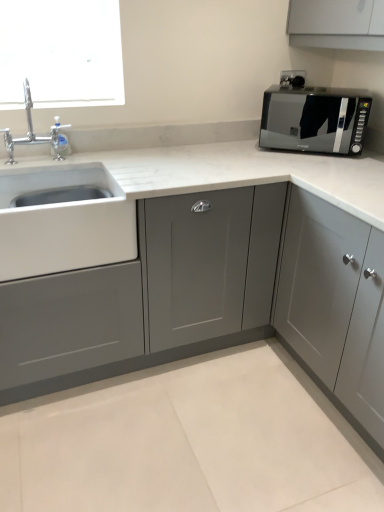
What is the approximate height of matte gray cabinet at upper right, arranged as the second cabinetry when viewed from the left?

39.06 inches.

Describe the element at coordinates (321, 293) in the screenshot. This screenshot has height=512, width=384. I see `matte gray cabinet at upper right, which is the first cabinetry in right-to-left order` at that location.

The width and height of the screenshot is (384, 512). What are the coordinates of `black glossy microwave at upper right` in the screenshot? It's located at (314, 119).

In order to face black glossy microwave at upper right, should I rotate leftwards or rightwards?

Turn right by 16.096 degrees to look at black glossy microwave at upper right.

Describe the element at coordinates (149, 295) in the screenshot. I see `matte gray cabinet at center, acting as the second cabinetry starting from the right` at that location.

Find the location of `white matte sink at left`. white matte sink at left is located at coordinates (63, 222).

In the scene shown: Measure the distance from matte gray cabinet at upper right, which is the first cabinetry in right-to-left order, to white matte sink at left.

The distance of matte gray cabinet at upper right, which is the first cabinetry in right-to-left order, from white matte sink at left is 32.58 inches.

Which of these two, matte gray cabinet at upper right, which is the first cabinetry in right-to-left order, or white matte sink at left, is bigger?

matte gray cabinet at upper right, which is the first cabinetry in right-to-left order, is bigger.

Which object is closer to the camera taking this photo, matte gray cabinet at upper right, arranged as the second cabinetry when viewed from the left, or white matte sink at left?

matte gray cabinet at upper right, arranged as the second cabinetry when viewed from the left, is in front.

In terms of height, does matte gray cabinet at upper right, arranged as the second cabinetry when viewed from the left, look taller or shorter compared to white matte sink at left?

Clearly, matte gray cabinet at upper right, arranged as the second cabinetry when viewed from the left, is taller compared to white matte sink at left.

From a real-world perspective, is matte gray cabinet at upper right, arranged as the second cabinetry when viewed from the left, located beneath matte gray cabinet at center, acting as the second cabinetry starting from the right?

Yes, from a real-world perspective, matte gray cabinet at upper right, arranged as the second cabinetry when viewed from the left, is beneath matte gray cabinet at center, acting as the second cabinetry starting from the right.

Does matte gray cabinet at upper right, arranged as the second cabinetry when viewed from the left, contain matte gray cabinet at center, placed as the first cabinetry when sorted from left to right?

Actually, matte gray cabinet at center, placed as the first cabinetry when sorted from left to right, is outside matte gray cabinet at upper right, arranged as the second cabinetry when viewed from the left.

Can you confirm if matte gray cabinet at upper right, arranged as the second cabinetry when viewed from the left, is taller than matte gray cabinet at center, placed as the first cabinetry when sorted from left to right?

Yes, matte gray cabinet at upper right, arranged as the second cabinetry when viewed from the left, is taller than matte gray cabinet at center, placed as the first cabinetry when sorted from left to right.

Does matte gray cabinet at upper right, arranged as the second cabinetry when viewed from the left, appear on the left side of matte gray cabinet at center, acting as the second cabinetry starting from the right?

In fact, matte gray cabinet at upper right, arranged as the second cabinetry when viewed from the left, is to the right of matte gray cabinet at center, acting as the second cabinetry starting from the right.

Would you say chrome metallic faucet at upper left is a long distance from black glossy microwave at upper right?

Absolutely, chrome metallic faucet at upper left is distant from black glossy microwave at upper right.

Considering the positions of objects chrome metallic faucet at upper left and black glossy microwave at upper right in the image provided, who is more to the right, chrome metallic faucet at upper left or black glossy microwave at upper right?

black glossy microwave at upper right.

Is chrome metallic faucet at upper left positioned with its back to black glossy microwave at upper right?

No, black glossy microwave at upper right is not at the back of chrome metallic faucet at upper left.

From a real-world perspective, is black glossy microwave at upper right positioned above or below white matte sink at left?

black glossy microwave at upper right is above white matte sink at left.

Would you say black glossy microwave at upper right is inside or outside white matte sink at left?

The correct answer is: outside.

Is black glossy microwave at upper right positioned before white matte sink at left?

No, it is not.

The width and height of the screenshot is (384, 512). Identify the location of sink in front of the black glossy microwave at upper right. (63, 222).

Is black glossy microwave at upper right next to matte gray cabinet at center, placed as the first cabinetry when sorted from left to right, and touching it?

No, black glossy microwave at upper right is not next to matte gray cabinet at center, placed as the first cabinetry when sorted from left to right.

From the image's perspective, is black glossy microwave at upper right below matte gray cabinet at center, placed as the first cabinetry when sorted from left to right?

Incorrect, from the image's perspective, black glossy microwave at upper right is higher than matte gray cabinet at center, placed as the first cabinetry when sorted from left to right.

Which object is further away from the camera taking this photo, black glossy microwave at upper right or matte gray cabinet at center, placed as the first cabinetry when sorted from left to right?

Positioned behind is black glossy microwave at upper right.

Considering the points (296, 127) and (224, 249), which point is behind, point (296, 127) or point (224, 249)?

The point (296, 127) is farther from the camera.

In the image, is chrome metallic faucet at upper left on the left side or the right side of matte gray cabinet at upper right, arranged as the second cabinetry when viewed from the left?

Clearly, chrome metallic faucet at upper left is on the left of matte gray cabinet at upper right, arranged as the second cabinetry when viewed from the left, in the image.

Would you consider chrome metallic faucet at upper left to be distant from matte gray cabinet at upper right, which is the first cabinetry in right-to-left order?

chrome metallic faucet at upper left is far away from matte gray cabinet at upper right, which is the first cabinetry in right-to-left order.

How far apart are chrome metallic faucet at upper left and matte gray cabinet at upper right, arranged as the second cabinetry when viewed from the left?

chrome metallic faucet at upper left and matte gray cabinet at upper right, arranged as the second cabinetry when viewed from the left, are 3.99 feet apart from each other.

Considering the relative sizes of chrome metallic faucet at upper left and matte gray cabinet at upper right, arranged as the second cabinetry when viewed from the left, in the image provided, is chrome metallic faucet at upper left taller than matte gray cabinet at upper right, arranged as the second cabinetry when viewed from the left,?

Incorrect, the height of chrome metallic faucet at upper left is not larger of that of matte gray cabinet at upper right, arranged as the second cabinetry when viewed from the left.

Considering the positions of point (288, 208) and point (9, 156), is point (288, 208) closer or farther from the camera than point (9, 156)?

Point (288, 208) is positioned closer to the camera compared to point (9, 156).

Which object is closer to the camera, matte gray cabinet at upper right, arranged as the second cabinetry when viewed from the left, or chrome metallic faucet at upper left?

matte gray cabinet at upper right, arranged as the second cabinetry when viewed from the left, is in front.

Considering the sizes of matte gray cabinet at upper right, which is the first cabinetry in right-to-left order, and chrome metallic faucet at upper left in the image, is matte gray cabinet at upper right, which is the first cabinetry in right-to-left order, bigger or smaller than chrome metallic faucet at upper left?

Considering their sizes, matte gray cabinet at upper right, which is the first cabinetry in right-to-left order, takes up more space than chrome metallic faucet at upper left.

Identify the location of sink that is above the matte gray cabinet at upper right, which is the first cabinetry in right-to-left order (from a real-world perspective). (63, 222).

The image size is (384, 512). What are the coordinates of `cabinetry behind the matte gray cabinet at upper right, arranged as the second cabinetry when viewed from the left` in the screenshot? It's located at (149, 295).

Estimate the real-world distances between objects in this image. Which object is further from chrome metallic faucet at upper left, white matte sink at left or matte gray cabinet at center, placed as the first cabinetry when sorted from left to right?

Among the two, matte gray cabinet at center, placed as the first cabinetry when sorted from left to right, is located further to chrome metallic faucet at upper left.

In the scene shown: Looking at the image, which one is located further to black glossy microwave at upper right, matte gray cabinet at center, placed as the first cabinetry when sorted from left to right, or matte gray cabinet at upper right, which is the first cabinetry in right-to-left order?

matte gray cabinet at center, placed as the first cabinetry when sorted from left to right, lies further to black glossy microwave at upper right than the other object.

Considering their positions, is chrome metallic faucet at upper left positioned closer to matte gray cabinet at upper right, which is the first cabinetry in right-to-left order, than white matte sink at left?

white matte sink at left is positioned closer to the anchor matte gray cabinet at upper right, which is the first cabinetry in right-to-left order.

Looking at the image, which one is located closer to matte gray cabinet at upper right, which is the first cabinetry in right-to-left order, chrome metallic faucet at upper left or matte gray cabinet at center, placed as the first cabinetry when sorted from left to right?

matte gray cabinet at center, placed as the first cabinetry when sorted from left to right, is positioned closer to the anchor matte gray cabinet at upper right, which is the first cabinetry in right-to-left order.

Estimate the real-world distances between objects in this image. Which object is further from matte gray cabinet at center, placed as the first cabinetry when sorted from left to right, black glossy microwave at upper right or matte gray cabinet at upper right, arranged as the second cabinetry when viewed from the left?

black glossy microwave at upper right is positioned further to the anchor matte gray cabinet at center, placed as the first cabinetry when sorted from left to right.

Based on their spatial positions, is white matte sink at left or matte gray cabinet at upper right, which is the first cabinetry in right-to-left order, further from matte gray cabinet at center, placed as the first cabinetry when sorted from left to right?

matte gray cabinet at upper right, which is the first cabinetry in right-to-left order, is further to matte gray cabinet at center, placed as the first cabinetry when sorted from left to right.

Which object lies nearer to the anchor point chrome metallic faucet at upper left, matte gray cabinet at center, placed as the first cabinetry when sorted from left to right, or white matte sink at left?

white matte sink at left lies closer to chrome metallic faucet at upper left than the other object.

Estimate the real-world distances between objects in this image. Which object is further from matte gray cabinet at upper right, which is the first cabinetry in right-to-left order, matte gray cabinet at center, placed as the first cabinetry when sorted from left to right, or black glossy microwave at upper right?

black glossy microwave at upper right is further to matte gray cabinet at upper right, which is the first cabinetry in right-to-left order.

You are a GUI agent. You are given a task and a screenshot of the screen. Output one action in this format:
    pyautogui.click(x=<x>, y=<y>)
    Task: Click on the microwave oven located between chrome metallic faucet at upper left and matte gray cabinet at upper right, which is the first cabinetry in right-to-left order, in the left-right direction
    This screenshot has width=384, height=512.
    Given the screenshot: What is the action you would take?
    pyautogui.click(x=314, y=119)

Where is `microwave oven between matte gray cabinet at center, placed as the first cabinetry when sorted from left to right, and matte gray cabinet at upper right, which is the first cabinetry in right-to-left order`? microwave oven between matte gray cabinet at center, placed as the first cabinetry when sorted from left to right, and matte gray cabinet at upper right, which is the first cabinetry in right-to-left order is located at coordinates (314, 119).

You are a GUI agent. You are given a task and a screenshot of the screen. Output one action in this format:
    pyautogui.click(x=<x>, y=<y>)
    Task: Click on the cabinetry located between chrome metallic faucet at upper left and black glossy microwave at upper right in the left-right direction
    
    Given the screenshot: What is the action you would take?
    pyautogui.click(x=149, y=295)

Find the location of a particular element. Image resolution: width=384 pixels, height=512 pixels. sink between chrome metallic faucet at upper left and black glossy microwave at upper right in the horizontal direction is located at coordinates (63, 222).